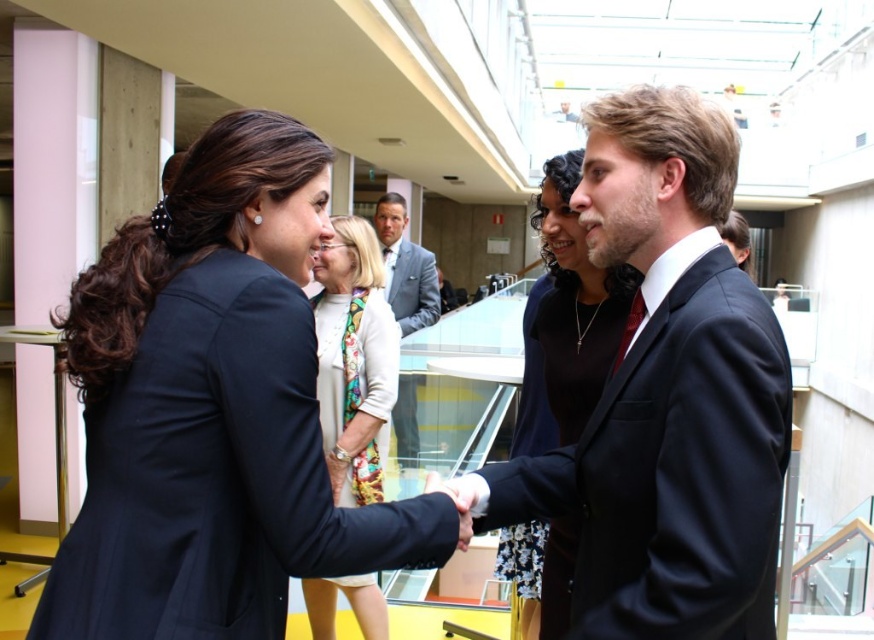
Question: Considering the real-world distances, which object is farthest from the matte black suit at center?

Choices:
 (A) light gray suit at center
 (B) white silk scarf at center

Answer: (A)

Question: Which of the following is the closest to the observer?

Choices:
 (A) (408, 397)
 (B) (573, 154)
 (C) (307, 198)

Answer: (C)

Question: Can you confirm if matte black suit at center is wider than matte black dress at center?

Choices:
 (A) no
 (B) yes

Answer: (B)

Question: Which point is farther to the camera?

Choices:
 (A) light gray suit at center
 (B) white silk scarf at center
 (C) matte black suit at center
 (D) shiny black suit at center

Answer: (A)

Question: Does shiny black suit at center have a lesser width compared to light gray suit at center?

Choices:
 (A) yes
 (B) no

Answer: (B)

Question: Is matte black suit at center further to the viewer compared to matte black dress at center?

Choices:
 (A) yes
 (B) no

Answer: (B)